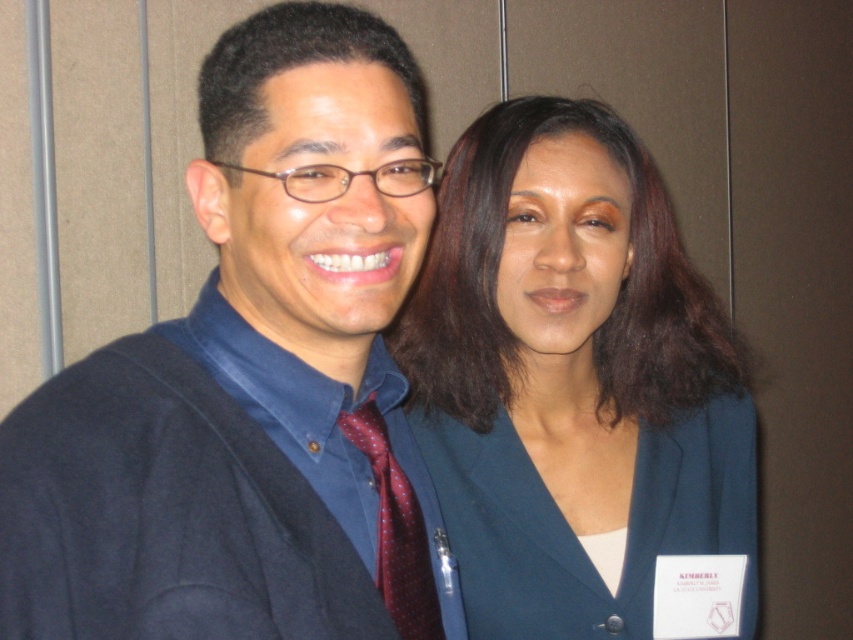
Does smooth dark blue blazer at center have a greater height compared to blue cotton dress shirt at left?

Indeed, smooth dark blue blazer at center has a greater height compared to blue cotton dress shirt at left.

The image size is (853, 640). Describe the element at coordinates (572, 380) in the screenshot. I see `smooth dark blue blazer at center` at that location.

Is point (482, 189) positioned behind point (334, 490)?

Yes, point (482, 189) is behind point (334, 490).

Where is `smooth dark blue blazer at center`? The height and width of the screenshot is (640, 853). smooth dark blue blazer at center is located at coordinates (572, 380).

How distant is smooth dark blue blazer at center from dark blue fabric business suit at center?

smooth dark blue blazer at center is 2.28 inches away from dark blue fabric business suit at center.

Which is more to the right, smooth dark blue blazer at center or dark blue fabric business suit at center?

Positioned to the right is dark blue fabric business suit at center.

Does point (619, 355) lie behind point (457, 470)?

Yes.

The height and width of the screenshot is (640, 853). I want to click on smooth dark blue blazer at center, so click(572, 380).

Between blue cotton dress shirt at left and maroon dotted silk tie at center, which one appears on the right side from the viewer's perspective?

Positioned to the right is maroon dotted silk tie at center.

Is blue cotton dress shirt at left to the left of maroon dotted silk tie at center from the viewer's perspective?

Indeed, blue cotton dress shirt at left is positioned on the left side of maroon dotted silk tie at center.

I want to click on blue cotton dress shirt at left, so click(x=339, y=452).